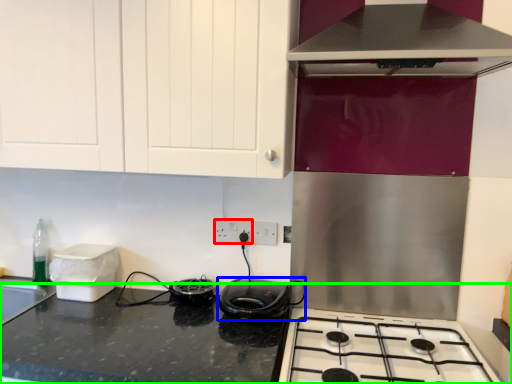
Question: Considering the real-world distances, which object is closest to electric outlet (highlighted by a red box)? kitchen appliance (highlighted by a blue box) or countertop (highlighted by a green box).

Choices:
 (A) kitchen appliance
 (B) countertop

Answer: (A)